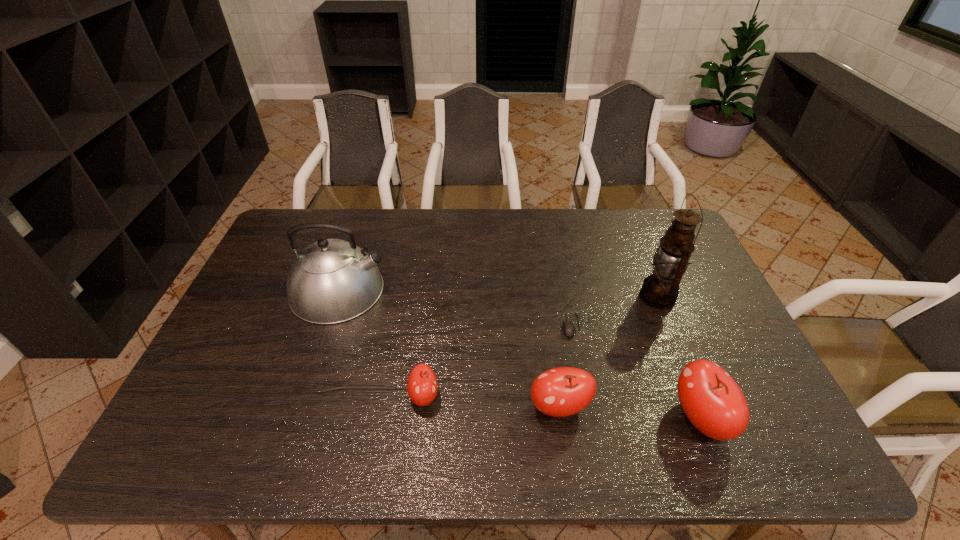
Considering the uniform spacing of apples, where should an additional apple be positioned on the left? Please locate a free spot. Please provide its 2D coordinates. Your answer should be formatted as a tuple, i.e. [(x, y)], where the tuple contains the x and y coordinates of a point satisfying the conditions above.

[(295, 385)]